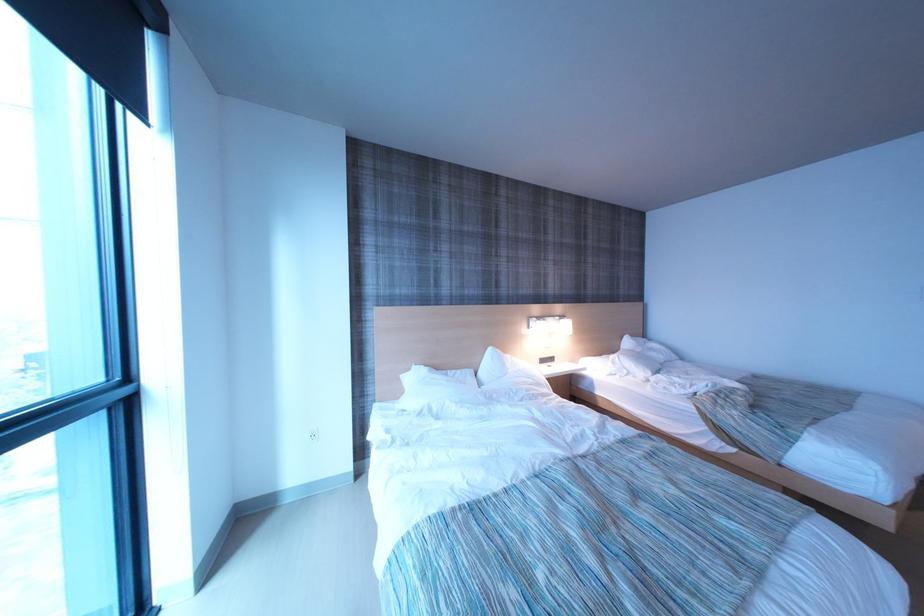
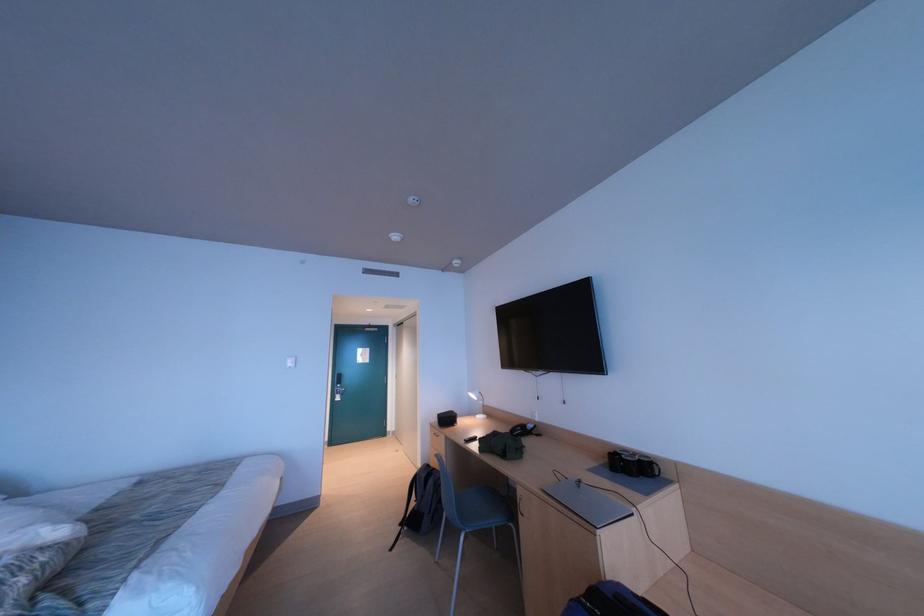
Question: The camera is either moving clockwise (left) or counter-clockwise (right) around the object. The first image is from the beginning of the video and the second image is from the end. Is the camera moving left or right when shooting the video?

Choices:
 (A) Left
 (B) Right

Answer: (A)